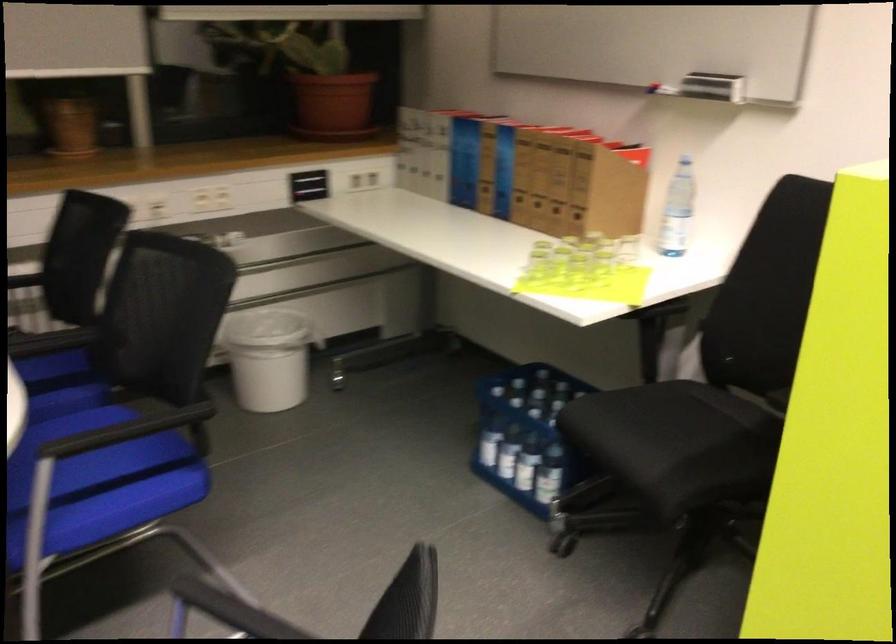
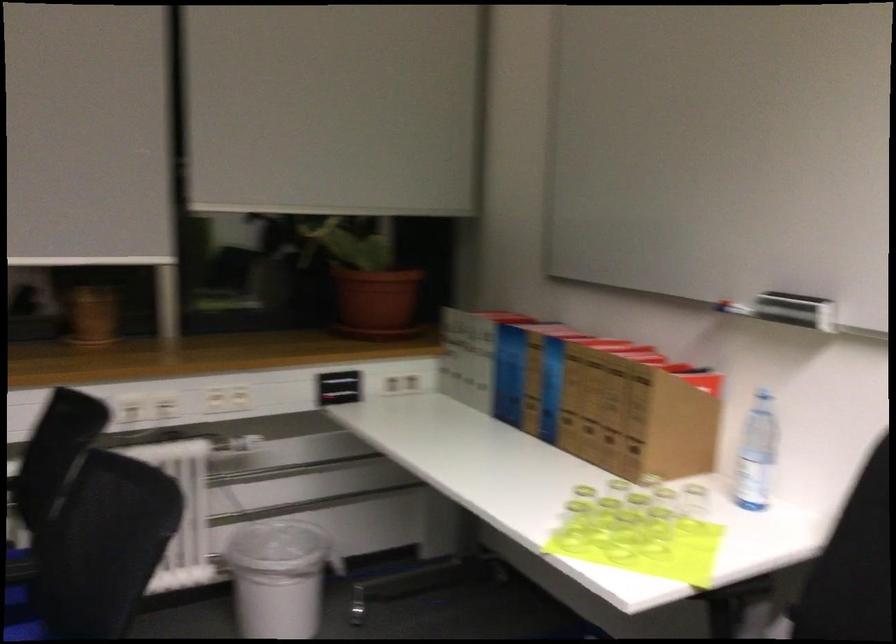
The images are taken continuously from a first-person perspective. In which direction are you moving?

The movement direction of the cameraman is right, forward.